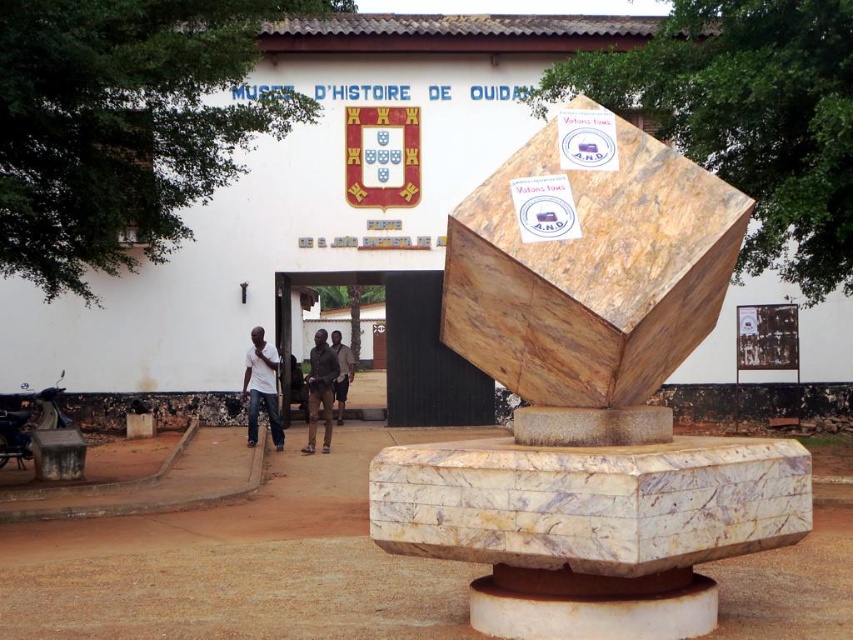
You are standing at the entrance of the MUS?E D?HISTOIRE DE OUAGA and want to place a brown leather jacket at center exactly 10 meters away from the marble sculpture at center. Based on the current placement, will you need to move the jacket closer or farther away?

The marble sculpture at center is currently 10.43 meters from the brown leather jacket at center. Since the desired distance is 10 meters, you need to move the jacket closer to the sculpture by 0.43 meters.

Looking at this image, you are standing in front of the MUS?E D?HISTOIRE DE OUAGA and want to take a photo of the marble sculpture at center. If your camera has a maximum focus range of 4 meters, will it be able to capture the sculpture clearly?

The marble sculpture at center is 4.37 meters away from the camera. Since the maximum focus range is 4 meters, the camera cannot capture the sculpture clearly at this distance.